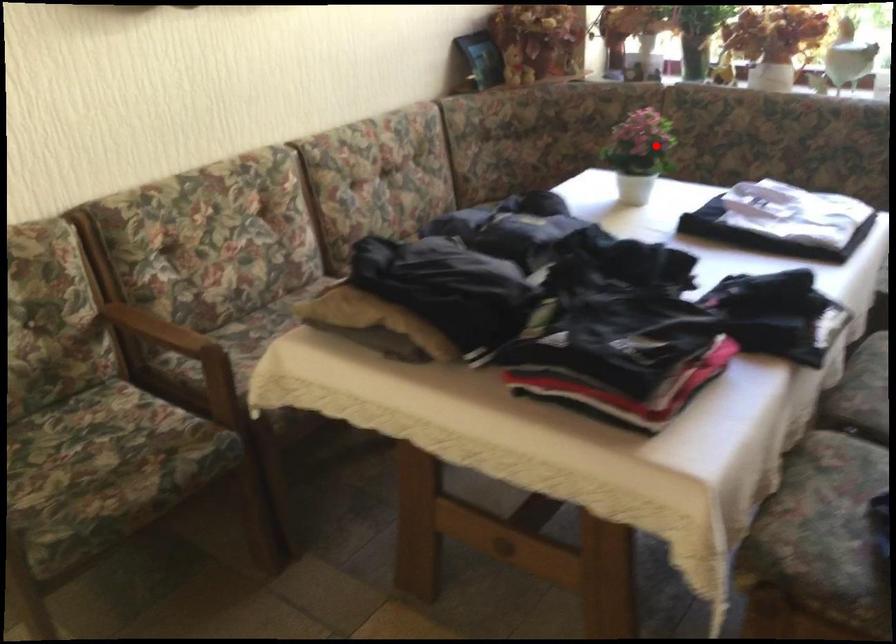
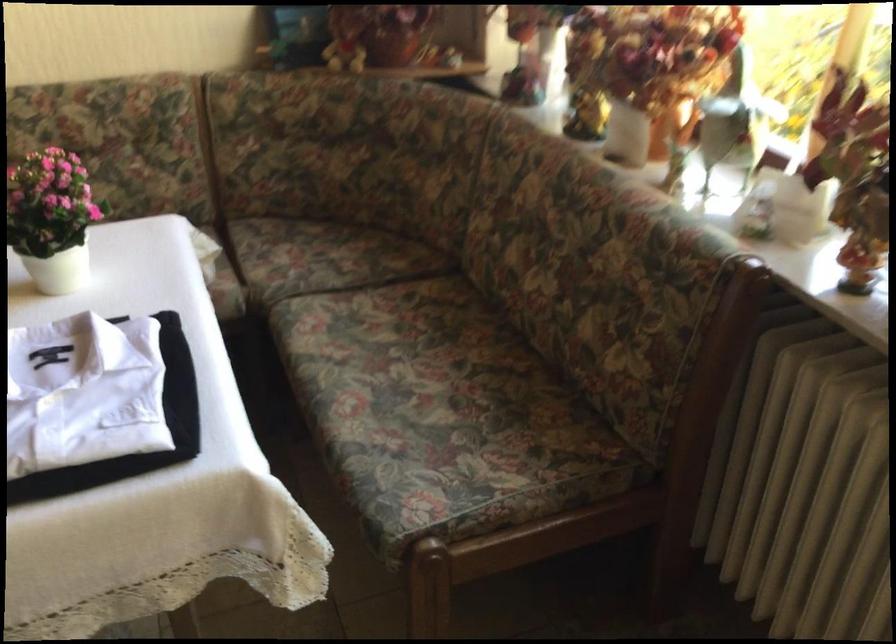
Question: I am providing you with two images of the same scene from different viewpoints. Image1 has a red point marked. In image2, the corresponding 3D location appears at what relative position? Reply with the corresponding letter.

Choices:
 (A) Closer
 (B) Farther

Answer: (A)